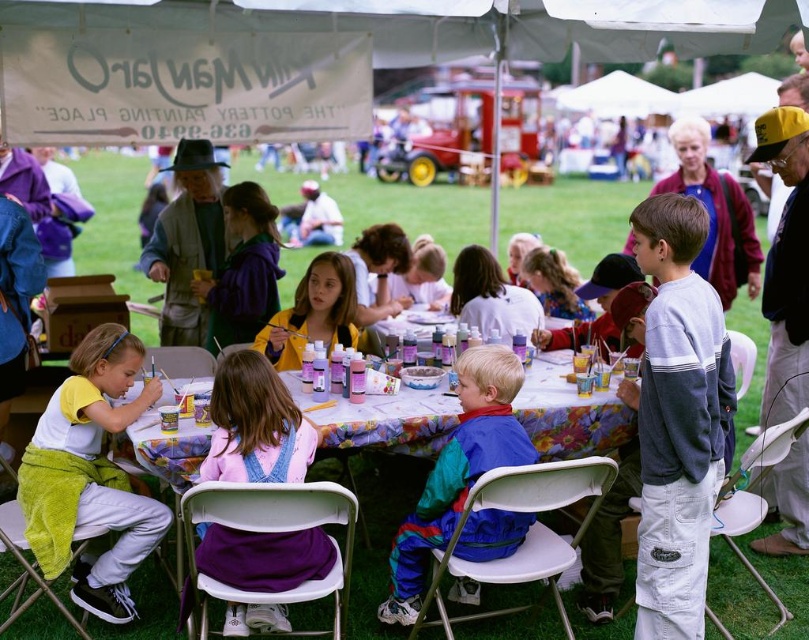
You are a parent at the event and want to take a photo of your child wearing the rainbow nylon jacket at center without the floral tablecloth at center blocking the view. Is the jacket taller than the tablecloth?

The floral tablecloth at center is not as tall as rainbow nylon jacket at center, so yes, the rainbow nylon jacket at center is taller than the floral tablecloth at center. You can take the photo without the tablecloth blocking the view.

You are a photographer standing in front of the art activity table. You want to take a photo that includes both the gray cotton sweatshirt at right and the white cotton shirt at center. Which clothing item will appear larger in the photo?

The gray cotton sweatshirt at right will appear larger in the photo because it is closer to the viewer than the white cotton shirt at center.